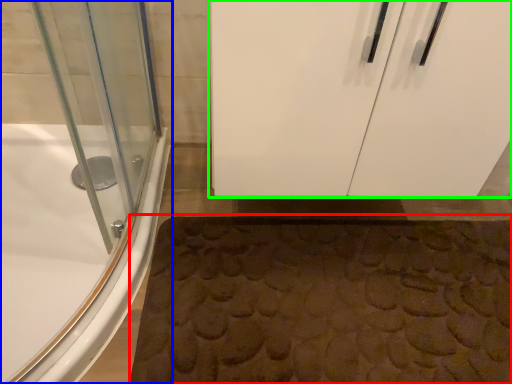
Question: Which object is positioned closest to bath mat (highlighted by a red box)? Select from bathtub (highlighted by a blue box) and door (highlighted by a green box).

Choices:
 (A) bathtub
 (B) door

Answer: (B)